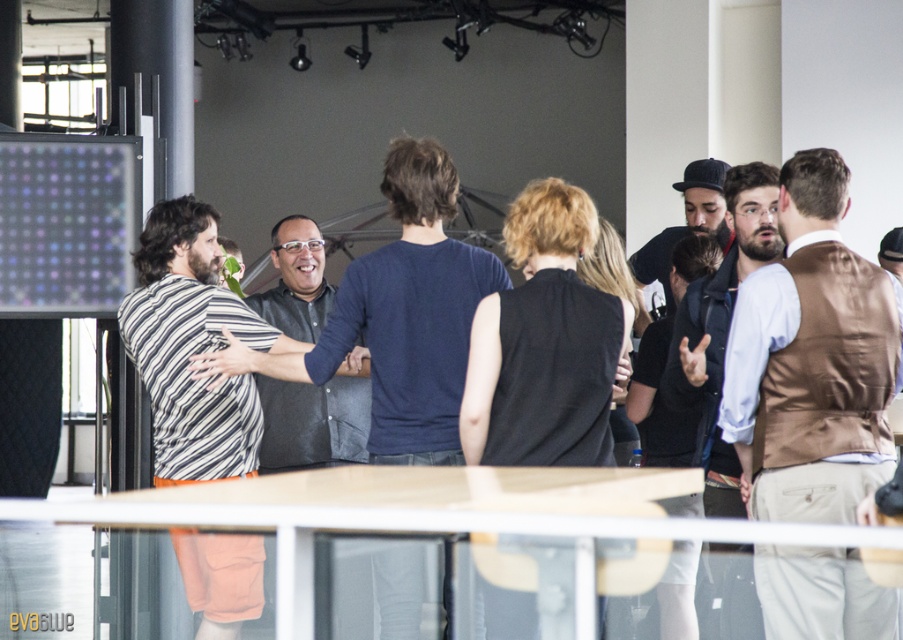
Is brown satin vest at right smaller than dark gray shirt at center?

Incorrect, brown satin vest at right is not smaller in size than dark gray shirt at center.

Who is taller, brown satin vest at right or dark gray shirt at center?

With more height is brown satin vest at right.

Is point (863, 388) in front of point (284, 467)?

Yes, it is.

Identify the location of brown satin vest at right. (812, 358).

Between brown satin vest at right and brown textured vest at right, which one has less height?

brown satin vest at right is shorter.

Who is higher up, brown satin vest at right or brown textured vest at right?

brown satin vest at right

Is point (888, 468) closer to viewer compared to point (725, 461)?

Yes, point (888, 468) is in front of point (725, 461).

This screenshot has width=903, height=640. I want to click on brown satin vest at right, so click(812, 358).

Can you confirm if brown textured vest at right is positioned below dark gray shirt at center?

Correct, brown textured vest at right is located below dark gray shirt at center.

The width and height of the screenshot is (903, 640). In order to click on brown textured vest at right in this screenshot , I will do `click(721, 330)`.

Find the location of a particular element. The width and height of the screenshot is (903, 640). brown textured vest at right is located at coordinates (721, 330).